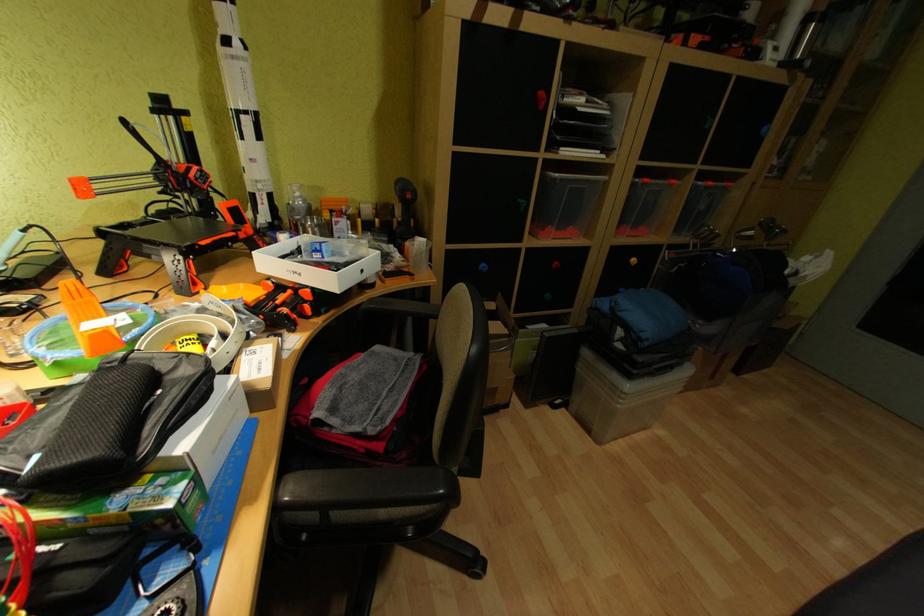
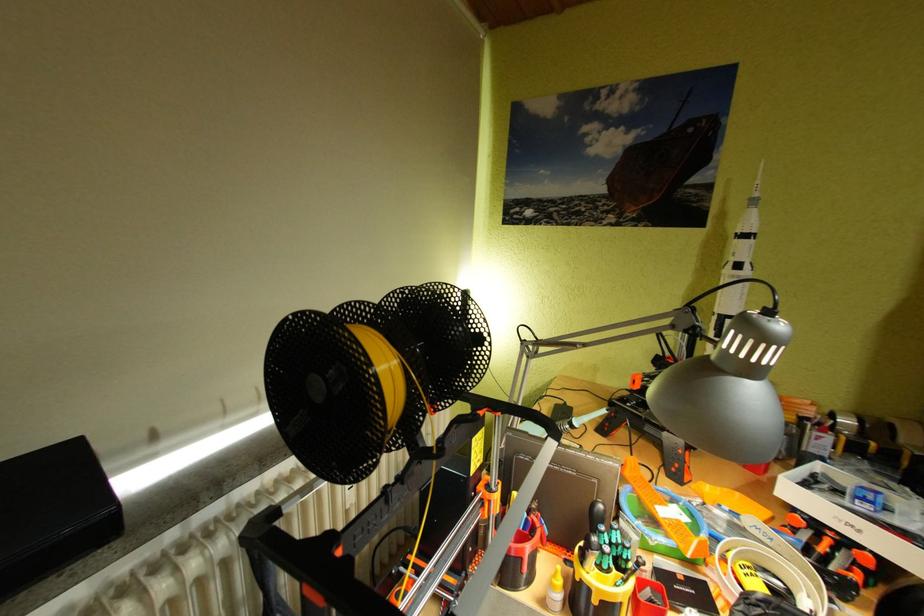
Question: The first image is from the beginning of the video and the second image is from the end. How did the camera likely rotate when shooting the video?

Choices:
 (A) Left
 (B) Right
 (C) Up
 (D) Down

Answer: (A)